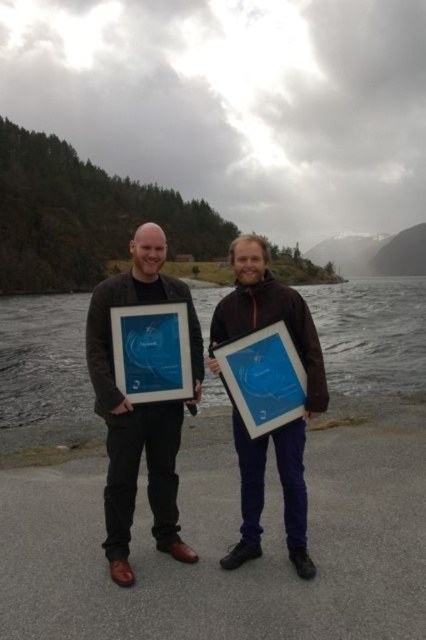
Question: Based on their relative distances, which object is farther from the blue glossy picture frame at center?

Choices:
 (A) matte plastic picture frame at center
 (B) blue glass water at center

Answer: (B)

Question: Which of the following is the closest to the observer?

Choices:
 (A) (279, 355)
 (B) (160, 436)

Answer: (A)

Question: Is matte black jacket at left further to the viewer compared to matte plastic picture frame at center?

Choices:
 (A) no
 (B) yes

Answer: (A)

Question: Does blue glass water at center have a greater width compared to matte black jacket at left?

Choices:
 (A) yes
 (B) no

Answer: (A)

Question: Which point is farther to the camera?

Choices:
 (A) (166, 316)
 (B) (100, 372)

Answer: (A)

Question: Considering the relative positions of matte blue frame at center and matte black jacket at left in the image provided, where is matte blue frame at center located with respect to matte black jacket at left?

Choices:
 (A) left
 (B) right

Answer: (B)